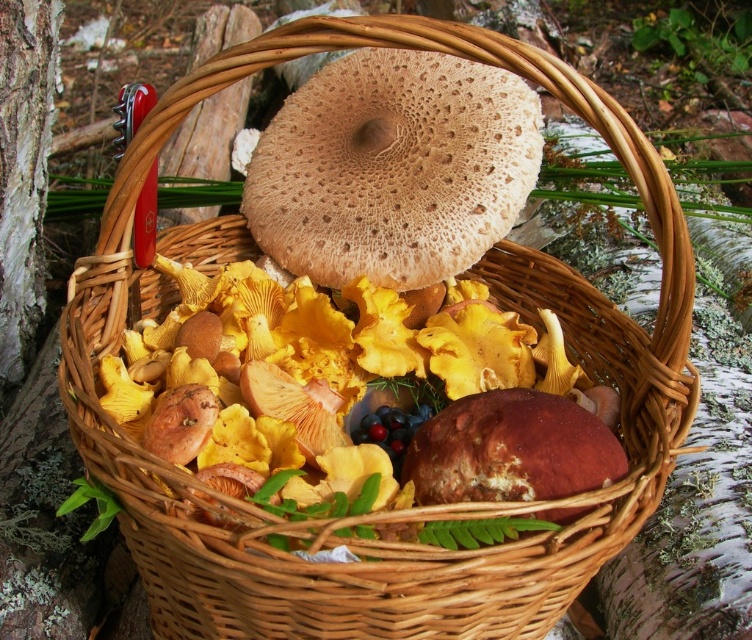
Who is shorter, yellow/golden flesh at center or shiny purple grapes at center?

shiny purple grapes at center is shorter.

In the scene shown: Which is more to the right, yellow/golden flesh at center or shiny purple grapes at center?

shiny purple grapes at center

Who is more forward, (149, 394) or (370, 426)?

Point (149, 394)

Image resolution: width=752 pixels, height=640 pixels. Find the location of `yellow/golden flesh at center`. yellow/golden flesh at center is located at coordinates (356, 396).

Is yellow/golden flesh at center above white bark at left?

Actually, yellow/golden flesh at center is below white bark at left.

Is point (599, 448) positioned behind point (20, 198)?

No, (599, 448) is closer to viewer.

The image size is (752, 640). In order to click on yellow/golden flesh at center in this screenshot , I will do `click(356, 396)`.

Find the location of a particular element. white bark at left is located at coordinates (23, 170).

Who is positioned more to the right, white bark at left or shiny purple grapes at center?

shiny purple grapes at center is more to the right.

The height and width of the screenshot is (640, 752). What do you see at coordinates (23, 170) in the screenshot?
I see `white bark at left` at bounding box center [23, 170].

Identify the location of white bark at left. (23, 170).